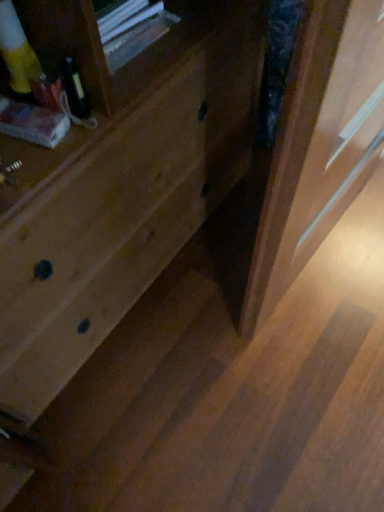
Question: Relative to wooden screen door at right, is natural wood drawer at center in front or behind?

Choices:
 (A) front
 (B) behind

Answer: (A)

Question: From the image's perspective, is natural wood drawer at center positioned above or below wooden screen door at right?

Choices:
 (A) below
 (B) above

Answer: (B)

Question: From a real-world perspective, relative to wooden screen door at right, is natural wood drawer at center vertically above or below?

Choices:
 (A) below
 (B) above

Answer: (B)

Question: Based on their sizes in the image, would you say wooden screen door at right is bigger or smaller than natural wood drawer at center?

Choices:
 (A) big
 (B) small

Answer: (B)

Question: Considering the positions of point pyautogui.click(x=327, y=115) and point pyautogui.click(x=52, y=308), is point pyautogui.click(x=327, y=115) closer or farther from the camera than point pyautogui.click(x=52, y=308)?

Choices:
 (A) farther
 (B) closer

Answer: (B)

Question: Is wooden screen door at right in front of or behind natural wood drawer at center in the image?

Choices:
 (A) behind
 (B) front

Answer: (A)

Question: Considering the relative positions of wooden screen door at right and natural wood drawer at center in the image provided, is wooden screen door at right to the left or to the right of natural wood drawer at center?

Choices:
 (A) left
 (B) right

Answer: (B)